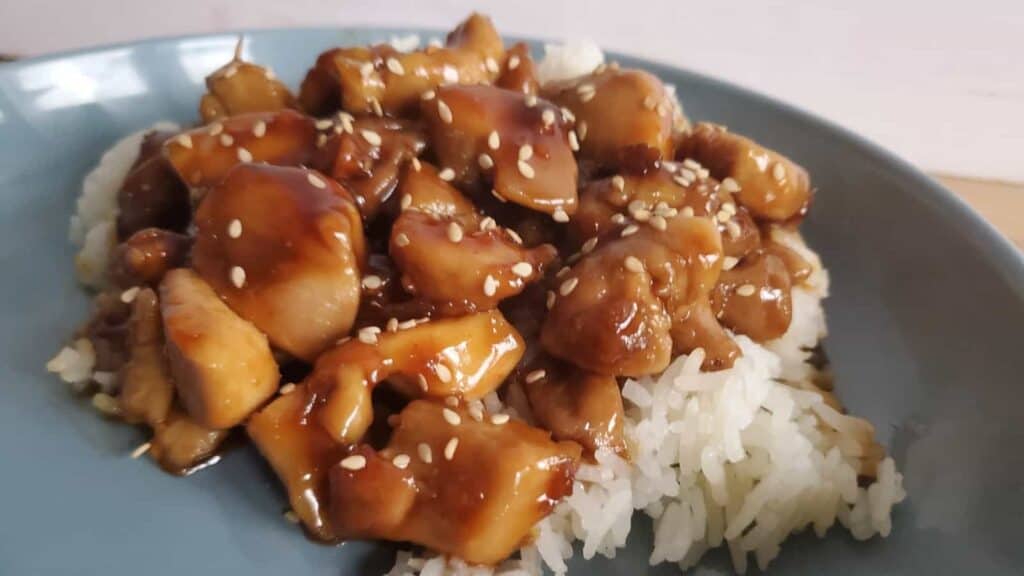
In order to click on table in this screenshot , I will do `click(1004, 208)`.